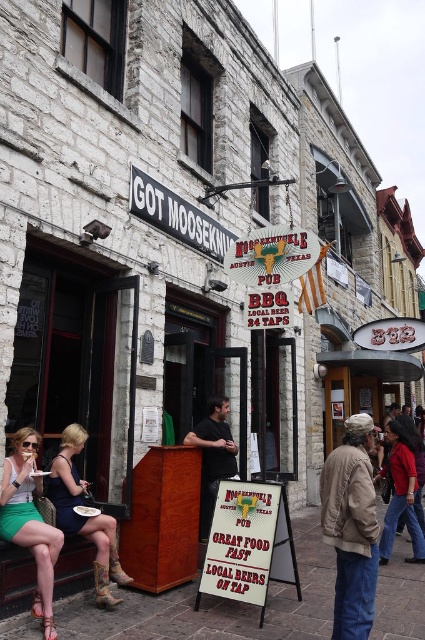
Question: Does matte green skirt at lower left have a lesser width compared to blacksign at upper center?

Choices:
 (A) no
 (B) yes

Answer: (B)

Question: Does white paper sign at center have a smaller size compared to blacksign at upper center?

Choices:
 (A) yes
 (B) no

Answer: (A)

Question: Based on their relative distances, which object is nearer to the leather boots at lower left?

Choices:
 (A) blacksign at upper center
 (B) white paper sign at center

Answer: (B)

Question: Which object is closer to the camera taking this photo?

Choices:
 (A) white paper sign at center
 (B) leather boots at lower left

Answer: (A)

Question: Based on their relative distances, which object is nearer to the white paper sign at center?

Choices:
 (A) matte green skirt at lower left
 (B) leather boots at lower left

Answer: (B)

Question: Can you confirm if white paper sign at center is positioned to the left of blacksign at upper center?

Choices:
 (A) yes
 (B) no

Answer: (B)